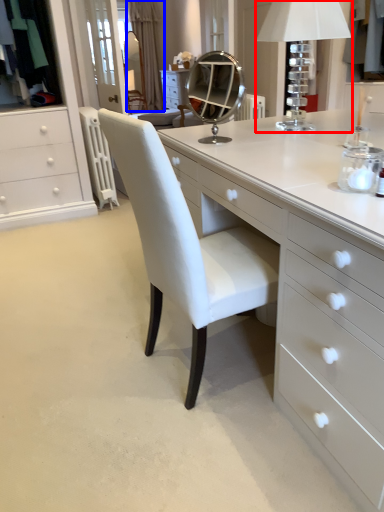
Question: Which object appears closest to the camera in this image, table lamp (highlighted by a red box) or curtain (highlighted by a blue box)?

Choices:
 (A) table lamp
 (B) curtain

Answer: (A)